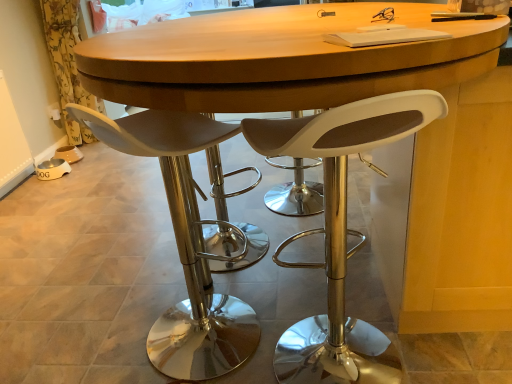
Locate an element on the screen. The height and width of the screenshot is (384, 512). free space that is in between white matte stool at center, arranged as the first chair when viewed from the left, and white matte stool at center, which is the second chair from left to right is located at coordinates [266, 317].